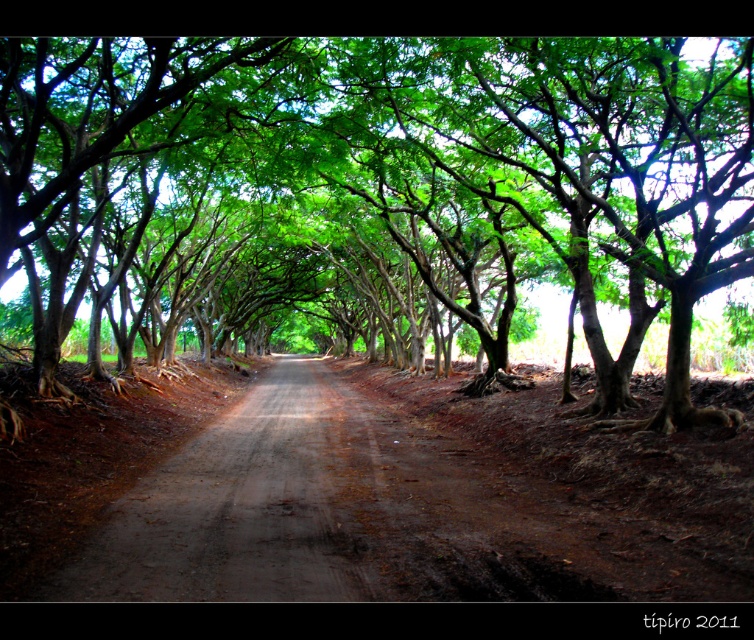
Which is more to the right, green leafy tree at center or dirt road at center?

From the viewer's perspective, dirt road at center appears more on the right side.

Is green leafy tree at center bigger than dirt road at center?

Yes, green leafy tree at center is bigger than dirt road at center.

Is point (657, 195) behind point (93, 579)?

Yes, it is behind point (93, 579).

Image resolution: width=754 pixels, height=640 pixels. What are the coordinates of `green leafy tree at center` in the screenshot? It's located at (428, 172).